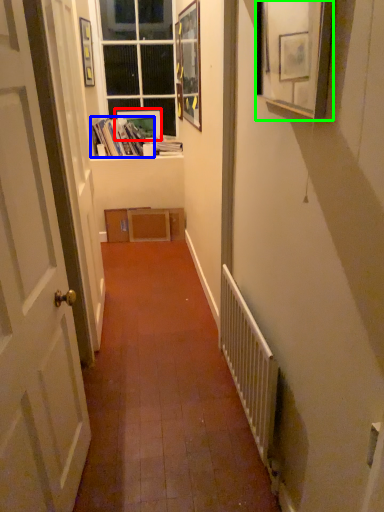
Question: Estimate the real-world distances between objects in this image. Which object is closer to picture frame (highlighted by a red box), book (highlighted by a blue box) or picture frame (highlighted by a green box)?

Choices:
 (A) book
 (B) picture frame

Answer: (A)